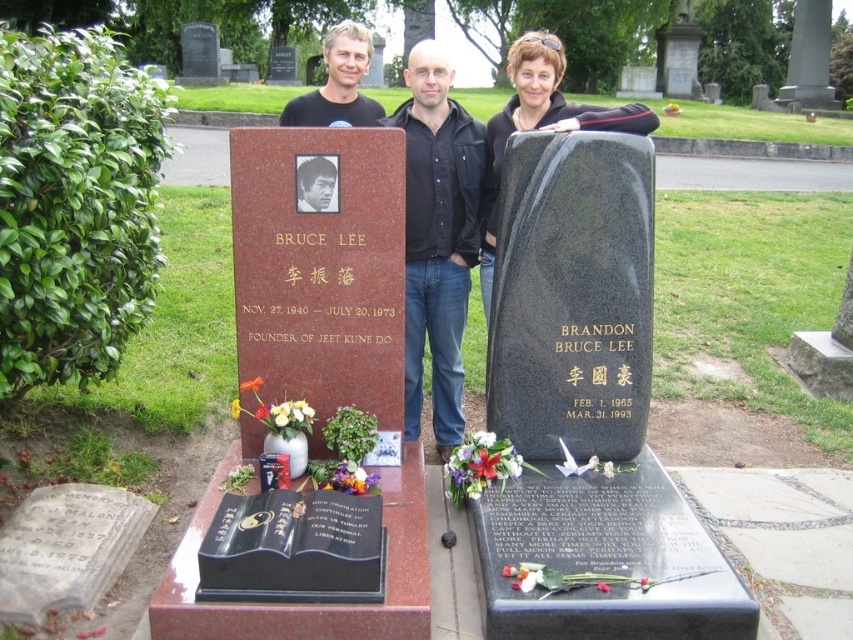
Question: Where is black matte shirt at center located in relation to smooth black hair at center in the image?

Choices:
 (A) right
 (B) left

Answer: (A)

Question: Does blonde hair at center appear on the right side of smooth black hair at center?

Choices:
 (A) yes
 (B) no

Answer: (B)

Question: Which point is farther from the camera taking this photo?

Choices:
 (A) (316, 198)
 (B) (473, 209)
 (C) (407, 268)
 (D) (514, 97)

Answer: (D)

Question: Can you confirm if black matte shirt at center is positioned below matte black jacket at center?

Choices:
 (A) no
 (B) yes

Answer: (B)

Question: Among these points, which one is farthest from the camera?

Choices:
 (A) (343, 99)
 (B) (531, 42)

Answer: (A)

Question: Among these objects, which one is farthest from the camera?

Choices:
 (A) smooth black hair at center
 (B) matte black jacket at center
 (C) black matte shirt at center
 (D) blonde hair at center

Answer: (D)